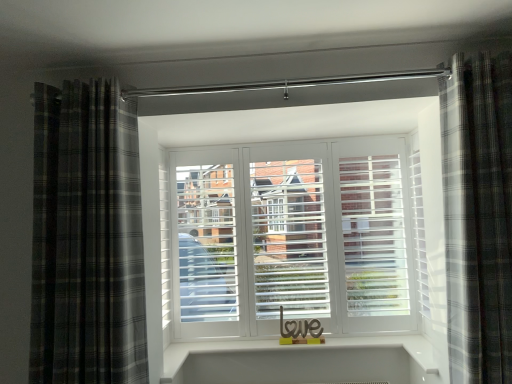
Question: Is plaid fabric curtain at right, which appears as the first curtain when viewed from the right, next to plaid fabric curtain at left, marked as the second curtain in a right-to-left arrangement?

Choices:
 (A) no
 (B) yes

Answer: (A)

Question: Is plaid fabric curtain at right, which appears as the first curtain when viewed from the right, not inside plaid fabric curtain at left, placed as the first curtain when sorted from left to right?

Choices:
 (A) yes
 (B) no

Answer: (A)

Question: Is there a large distance between plaid fabric curtain at right, which appears as the first curtain when viewed from the right, and plaid fabric curtain at left, placed as the first curtain when sorted from left to right?

Choices:
 (A) no
 (B) yes

Answer: (B)

Question: Can you confirm if plaid fabric curtain at right, marked as the 2th curtain in a left-to-right arrangement, is taller than plaid fabric curtain at left, marked as the second curtain in a right-to-left arrangement?

Choices:
 (A) yes
 (B) no

Answer: (A)

Question: Can you confirm if plaid fabric curtain at right, marked as the 2th curtain in a left-to-right arrangement, is smaller than plaid fabric curtain at left, placed as the first curtain when sorted from left to right?

Choices:
 (A) no
 (B) yes

Answer: (B)

Question: Could you tell me if plaid fabric curtain at right, which appears as the first curtain when viewed from the right, is turned towards plaid fabric curtain at left, marked as the second curtain in a right-to-left arrangement?

Choices:
 (A) yes
 (B) no

Answer: (B)

Question: Considering the relative positions of plaid fabric curtain at left, placed as the first curtain when sorted from left to right, and plaid fabric curtain at right, marked as the 2th curtain in a left-to-right arrangement, in the image provided, is plaid fabric curtain at left, placed as the first curtain when sorted from left to right, to the left of plaid fabric curtain at right, marked as the 2th curtain in a left-to-right arrangement, from the viewer's perspective?

Choices:
 (A) no
 (B) yes

Answer: (B)

Question: Is plaid fabric curtain at left, placed as the first curtain when sorted from left to right, to the right of plaid fabric curtain at right, marked as the 2th curtain in a left-to-right arrangement, from the viewer's perspective?

Choices:
 (A) no
 (B) yes

Answer: (A)

Question: Is plaid fabric curtain at left, placed as the first curtain when sorted from left to right, oriented away from plaid fabric curtain at right, which appears as the first curtain when viewed from the right?

Choices:
 (A) no
 (B) yes

Answer: (A)

Question: Considering the relative sizes of plaid fabric curtain at left, placed as the first curtain when sorted from left to right, and plaid fabric curtain at right, which appears as the first curtain when viewed from the right, in the image provided, is plaid fabric curtain at left, placed as the first curtain when sorted from left to right, wider than plaid fabric curtain at right, which appears as the first curtain when viewed from the right,?

Choices:
 (A) yes
 (B) no

Answer: (A)

Question: Can you confirm if plaid fabric curtain at left, marked as the second curtain in a right-to-left arrangement, is bigger than plaid fabric curtain at right, marked as the 2th curtain in a left-to-right arrangement?

Choices:
 (A) no
 (B) yes

Answer: (B)

Question: Does plaid fabric curtain at left, marked as the second curtain in a right-to-left arrangement, have a lesser height compared to plaid fabric curtain at right, which appears as the first curtain when viewed from the right?

Choices:
 (A) no
 (B) yes

Answer: (B)

Question: Based on their positions, is plaid fabric curtain at right, which appears as the first curtain when viewed from the right, located to the left or right of plaid fabric curtain at left, placed as the first curtain when sorted from left to right?

Choices:
 (A) right
 (B) left

Answer: (A)